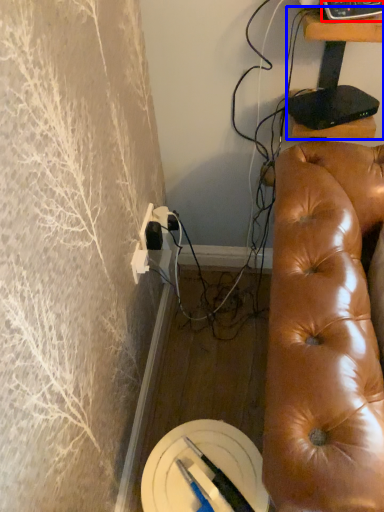
Question: Which of the following is the closest to the observer, equipment (highlighted by a red box) or furniture (highlighted by a blue box)?

Choices:
 (A) equipment
 (B) furniture

Answer: (A)